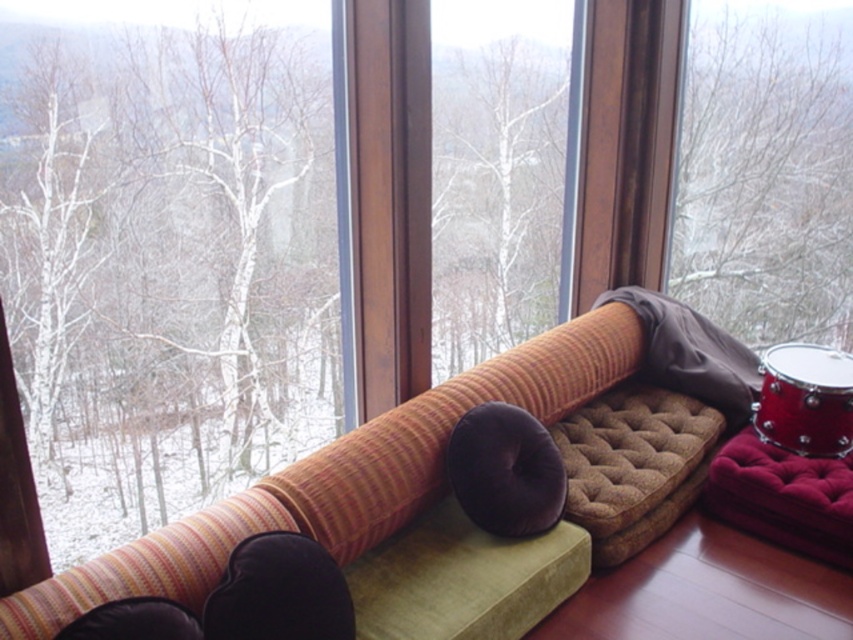
Question: Does velvet brown pillow at center appear under shiny red drum at lower right?

Choices:
 (A) yes
 (B) no

Answer: (A)

Question: Does velvet brown pillow at center appear under shiny red drum at lower right?

Choices:
 (A) yes
 (B) no

Answer: (A)

Question: Can you confirm if striped fabric couch at center is wider than velvet brown pillow at center?

Choices:
 (A) yes
 (B) no

Answer: (A)

Question: Which is nearer to the velvet maroon stool at lower right?

Choices:
 (A) velvet brown pillow at center
 (B) shiny red drum at lower right

Answer: (B)

Question: Which point is closer to the camera?

Choices:
 (A) (770, 516)
 (B) (845, 369)
 (C) (392, 472)
 (D) (527, 464)

Answer: (C)

Question: Which of the following is the farthest from the observer?

Choices:
 (A) (733, 509)
 (B) (537, 452)

Answer: (A)